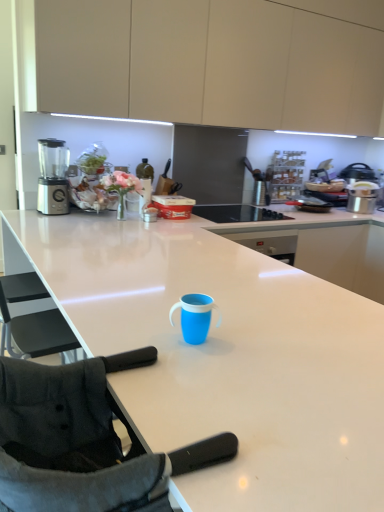
Question: Is satin silver blender at left taller than black glass cooktop at center?

Choices:
 (A) yes
 (B) no

Answer: (A)

Question: Does satin silver blender at left have a smaller size compared to black glass cooktop at center?

Choices:
 (A) no
 (B) yes

Answer: (B)

Question: From the image's perspective, is satin silver blender at left above black glass cooktop at center?

Choices:
 (A) yes
 (B) no

Answer: (A)

Question: Is satin silver blender at left closer to the viewer compared to black glass cooktop at center?

Choices:
 (A) no
 (B) yes

Answer: (B)

Question: Could you tell me if satin silver blender at left is facing black glass cooktop at center?

Choices:
 (A) yes
 (B) no

Answer: (B)

Question: Considering the positions of matte beige cabinets at upper center and blue plastic sippy cup at center in the image, is matte beige cabinets at upper center wider or thinner than blue plastic sippy cup at center?

Choices:
 (A) thin
 (B) wide

Answer: (B)

Question: Relative to blue plastic sippy cup at center, is matte beige cabinets at upper center in front or behind?

Choices:
 (A) front
 (B) behind

Answer: (B)

Question: From a real-world perspective, is matte beige cabinets at upper center physically located above or below blue plastic sippy cup at center?

Choices:
 (A) above
 (B) below

Answer: (A)

Question: Choose the correct answer: Is matte beige cabinets at upper center inside blue plastic sippy cup at center or outside it?

Choices:
 (A) outside
 (B) inside

Answer: (A)

Question: From a real-world perspective, is blue plastic sippy cup at center above or below black glass cooktop at center?

Choices:
 (A) below
 (B) above

Answer: (B)

Question: Looking at their shapes, would you say blue plastic sippy cup at center is wider or thinner than black glass cooktop at center?

Choices:
 (A) wide
 (B) thin

Answer: (B)

Question: Which is correct: blue plastic sippy cup at center is inside black glass cooktop at center, or outside of it?

Choices:
 (A) inside
 (B) outside

Answer: (B)

Question: Based on their positions, is blue plastic sippy cup at center located to the left or right of black glass cooktop at center?

Choices:
 (A) right
 (B) left

Answer: (B)

Question: From a real-world perspective, is black fabric folding chair at lower left above or below blue plastic sippy cup at center?

Choices:
 (A) below
 (B) above

Answer: (A)

Question: Is black fabric folding chair at lower left bigger or smaller than blue plastic sippy cup at center?

Choices:
 (A) big
 (B) small

Answer: (A)